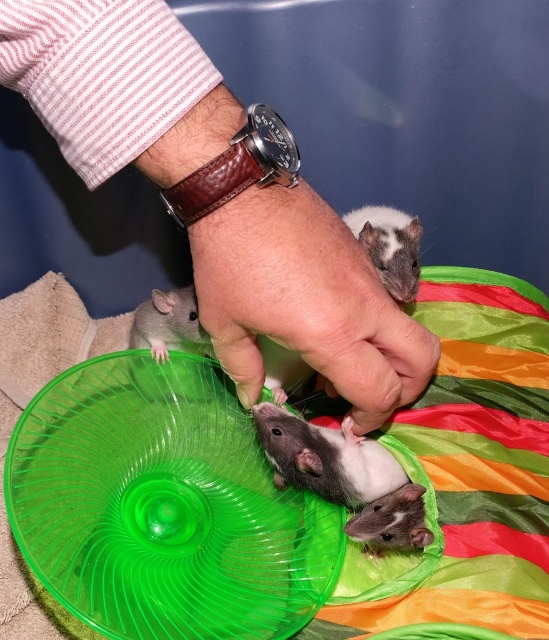
You are a photographer trying to capture a close shot of the hand interacting with the rodents. You notice two points marked in the scene. Which point is closer to the camera, point [257,384] or point [394,548]?

Point [257,384] is in front of point [394,548], so it is closer to the camera.

You are a small pet owner who wants to place a treat between the brown leather wristwatch at center and the white glossy mouse at center. What is the minimum distance you need to move the treat to ensure it is exactly halfway between them?

The minimum distance to move the treat to place it exactly halfway between the brown leather wristwatch at center and the white glossy mouse at center is 4.035 inches, which is half of their 8.07 inches separation.